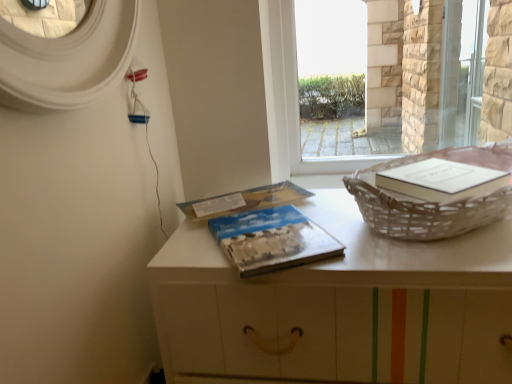
Find the location of a particular element. This screenshot has width=512, height=384. blank space situated above white matte table at center (from a real-world perspective) is located at coordinates (x=298, y=223).